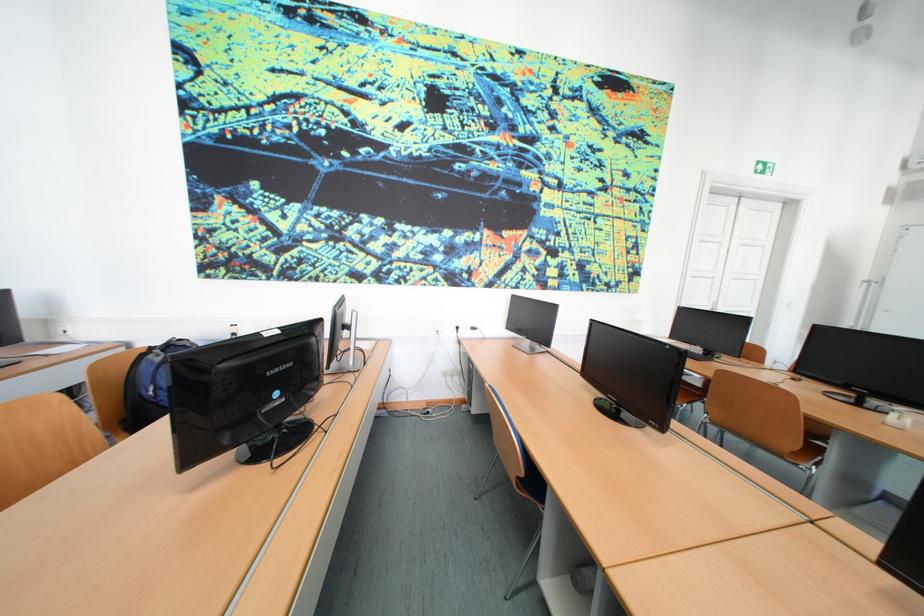
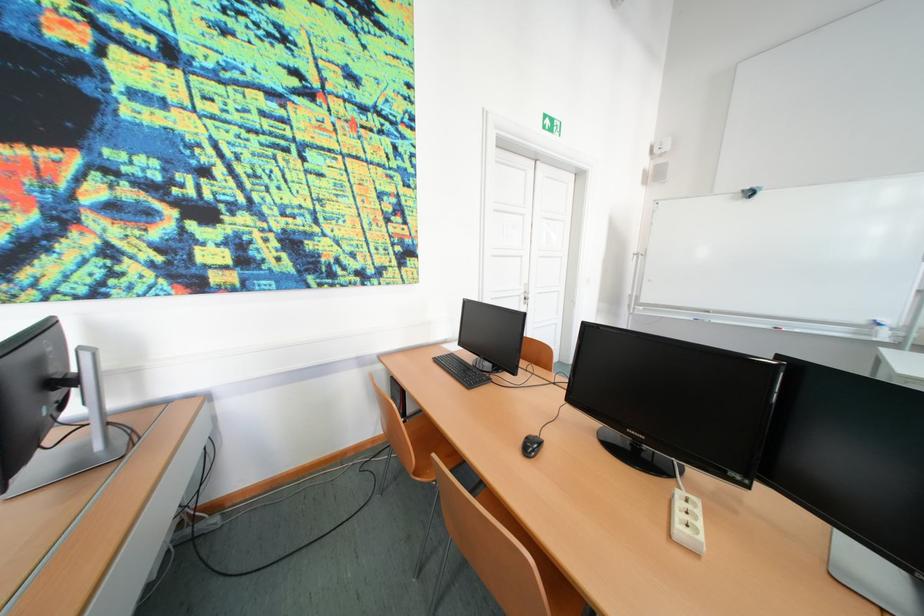
The images are taken continuously from a first-person perspective. In which direction are you moving?

The movement direction of the cameraman is right, forward.